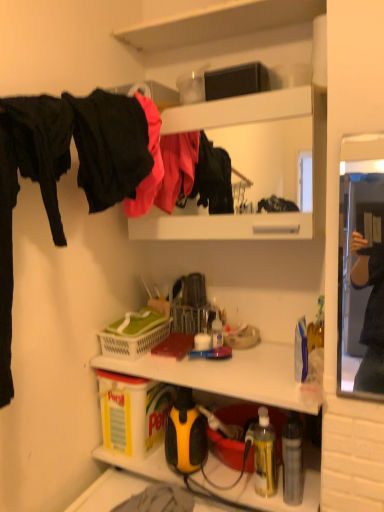
The height and width of the screenshot is (512, 384). Find the location of `metallic silver bottle at lower right, the first bottle in the right-to-left sequence`. metallic silver bottle at lower right, the first bottle in the right-to-left sequence is located at coordinates (292, 462).

Where is `black matte fabric at left, the 1th clothing positioned from the front`? Image resolution: width=384 pixels, height=512 pixels. black matte fabric at left, the 1th clothing positioned from the front is located at coordinates (111, 148).

At what (x,y) coordinates should I click in order to perform the action: click on black matte box at upper center, which appears as the second box when viewed from the left. Please return your answer as a coordinate pair (x, y). Image resolution: width=384 pixels, height=512 pixels. Looking at the image, I should click on (236, 81).

The width and height of the screenshot is (384, 512). What are the coordinates of `yellow plastic box at lower left, positioned as the 2th box in right-to-left order` in the screenshot? It's located at (132, 412).

In order to face translucent yellow bottle at lower right, marked as the first bottle in a left-to-right arrangement, should I rotate leftwards or rightwards?

It's best to rotate right around 9.762 degrees.

Where is `yellow/black plastic sprayer at lower center`? yellow/black plastic sprayer at lower center is located at coordinates (228, 374).

At what (x,y) coordinates should I click in order to perform the action: click on white matte cabinet at upper center. Please return your answer as a coordinate pair (x, y). Looking at the image, I should click on (251, 164).

Can you tell me how much white matte cabinet at upper center and translucent yellow bottle at lower right, marked as the first bottle in a left-to-right arrangement, differ in facing direction?

5.64 degrees separate the facing orientations of white matte cabinet at upper center and translucent yellow bottle at lower right, marked as the first bottle in a left-to-right arrangement.

Does white matte cabinet at upper center turn towards translucent yellow bottle at lower right, which is the 2th bottle in right-to-left order?

No, white matte cabinet at upper center is not oriented towards translucent yellow bottle at lower right, which is the 2th bottle in right-to-left order.

Which object is further away from the camera, white matte cabinet at upper center or translucent yellow bottle at lower right, which is the 2th bottle in right-to-left order?

Positioned behind is translucent yellow bottle at lower right, which is the 2th bottle in right-to-left order.

From the picture: How distant is white matte cabinet at upper center from translucent yellow bottle at lower right, marked as the first bottle in a left-to-right arrangement?

white matte cabinet at upper center is 1.63 meters from translucent yellow bottle at lower right, marked as the first bottle in a left-to-right arrangement.

Is matte black jacket at upper center, placed as the first clothing when sorted from back to front, facing towards white plastic picnic basket at center?

No, matte black jacket at upper center, placed as the first clothing when sorted from back to front, is not facing towards white plastic picnic basket at center.

Does matte black jacket at upper center, which ranks as the 2th clothing in front-to-back order, have a greater height compared to white plastic picnic basket at center?

Yes, matte black jacket at upper center, which ranks as the 2th clothing in front-to-back order, is taller than white plastic picnic basket at center.

Between matte black jacket at upper center, placed as the first clothing when sorted from back to front, and white plastic picnic basket at center, which one has larger size?

matte black jacket at upper center, placed as the first clothing when sorted from back to front.

From the image's perspective, does matte black jacket at upper center, which ranks as the 2th clothing in front-to-back order, appear lower than white plastic picnic basket at center?

Actually, matte black jacket at upper center, which ranks as the 2th clothing in front-to-back order, appears above white plastic picnic basket at center in the image.

Based on the photo, is metallic silver bottle at lower right, the second bottle viewed from the left, inside or outside of black matte box at upper center, which appears as the second box when viewed from the left?

metallic silver bottle at lower right, the second bottle viewed from the left, is located beyond the bounds of black matte box at upper center, which appears as the second box when viewed from the left.

Is metallic silver bottle at lower right, the second bottle viewed from the left, looking in the opposite direction of black matte box at upper center, the 1th box positioned from the right?

That's not correct — metallic silver bottle at lower right, the second bottle viewed from the left, is not looking away from black matte box at upper center, the 1th box positioned from the right.

Who is taller, metallic silver bottle at lower right, the second bottle viewed from the left, or black matte box at upper center, the 1th box positioned from the right?

Standing taller between the two is metallic silver bottle at lower right, the second bottle viewed from the left.

Looking at this image, is metallic silver bottle at lower right, the first bottle in the right-to-left sequence, far away from black matte box at upper center, the first box when ordered from top to bottom?

metallic silver bottle at lower right, the first bottle in the right-to-left sequence, is near black matte box at upper center, the first box when ordered from top to bottom, not far away.

Between black matte fabric at left, the 1th clothing positioned from the front, and yellow plastic box at lower left, positioned as the 2th box in right-to-left order, which one has more height?

black matte fabric at left, the 1th clothing positioned from the front.

Could you tell me if black matte fabric at left, the second clothing in the back-to-front sequence, is facing yellow plastic box at lower left, the second box in the top-to-bottom sequence?

No, black matte fabric at left, the second clothing in the back-to-front sequence, is not turned towards yellow plastic box at lower left, the second box in the top-to-bottom sequence.

Would you say black matte fabric at left, the second clothing in the back-to-front sequence, is outside yellow plastic box at lower left, positioned as the 2th box in right-to-left order?

Yes, black matte fabric at left, the second clothing in the back-to-front sequence, is not within yellow plastic box at lower left, positioned as the 2th box in right-to-left order.

From a real-world perspective, is black matte fabric at left, the 1th clothing positioned from the front, physically located above or below yellow plastic box at lower left, the second box in the top-to-bottom sequence?

black matte fabric at left, the 1th clothing positioned from the front, is above yellow plastic box at lower left, the second box in the top-to-bottom sequence.

Could you tell me if matte black jacket at upper center, which ranks as the 2th clothing in front-to-back order, is turned towards yellow plastic box at lower left, the second box in the top-to-bottom sequence?

No, matte black jacket at upper center, which ranks as the 2th clothing in front-to-back order, is not aimed at yellow plastic box at lower left, the second box in the top-to-bottom sequence.

Is point (135, 93) less distant than point (133, 394)?

Yes, it is.

In terms of width, does translucent yellow bottle at lower right, marked as the first bottle in a left-to-right arrangement, look wider or thinner when compared to yellow plastic box at lower left, placed as the first box when sorted from bottom to top?

translucent yellow bottle at lower right, marked as the first bottle in a left-to-right arrangement, is thinner than yellow plastic box at lower left, placed as the first box when sorted from bottom to top.

Is translucent yellow bottle at lower right, marked as the first bottle in a left-to-right arrangement, facing towards yellow plastic box at lower left, placed as the first box when sorted from left to right?

No, translucent yellow bottle at lower right, marked as the first bottle in a left-to-right arrangement, does not turn towards yellow plastic box at lower left, placed as the first box when sorted from left to right.

Is translucent yellow bottle at lower right, marked as the first bottle in a left-to-right arrangement, to the right of yellow plastic box at lower left, placed as the first box when sorted from left to right, from the viewer's perspective?

Yes, translucent yellow bottle at lower right, marked as the first bottle in a left-to-right arrangement, is to the right of yellow plastic box at lower left, placed as the first box when sorted from left to right.

Considering the sizes of objects translucent yellow bottle at lower right, marked as the first bottle in a left-to-right arrangement, and yellow plastic box at lower left, positioned as the 2th box in right-to-left order, in the image provided, who is smaller, translucent yellow bottle at lower right, marked as the first bottle in a left-to-right arrangement, or yellow plastic box at lower left, positioned as the 2th box in right-to-left order,?

With smaller size is translucent yellow bottle at lower right, marked as the first bottle in a left-to-right arrangement.

Does yellow/black plastic sprayer at lower center have a lesser width compared to matte black jacket at upper center, which ranks as the 2th clothing in front-to-back order?

Incorrect, the width of yellow/black plastic sprayer at lower center is not less than that of matte black jacket at upper center, which ranks as the 2th clothing in front-to-back order.

Is yellow/black plastic sprayer at lower center not near matte black jacket at upper center, which ranks as the 2th clothing in front-to-back order?

They are positioned close to each other.

In the image, is yellow/black plastic sprayer at lower center positioned in front of or behind matte black jacket at upper center, which ranks as the 2th clothing in front-to-back order?

yellow/black plastic sprayer at lower center is positioned closer to the viewer than matte black jacket at upper center, which ranks as the 2th clothing in front-to-back order.

Which is correct: yellow/black plastic sprayer at lower center is inside matte black jacket at upper center, placed as the first clothing when sorted from back to front, or outside of it?

yellow/black plastic sprayer at lower center is not enclosed by matte black jacket at upper center, placed as the first clothing when sorted from back to front.

Find the location of a particular element. The image size is (384, 512). cabinet that appears on the left of translucent yellow bottle at lower right, which is the 2th bottle in right-to-left order is located at coordinates (251, 164).

There is a white plastic picnic basket at center. Identify the location of the 2nd clothing above it (from the image's perspective). (153, 164).

Looking at the image, which one is located closer to black matte box at upper center, which ranks as the 2th box in bottom-to-top order, black matte fabric at left, the 1th clothing positioned from the front, or white matte cabinet at upper center?

black matte fabric at left, the 1th clothing positioned from the front, lies closer to black matte box at upper center, which ranks as the 2th box in bottom-to-top order, than the other object.

Which object lies nearer to the anchor point yellow/black plastic sprayer at lower center, yellow plastic box at lower left, positioned as the 2th box in right-to-left order, or white matte cabinet at upper center?

Based on the image, yellow plastic box at lower left, positioned as the 2th box in right-to-left order, appears to be nearer to yellow/black plastic sprayer at lower center.

Looking at the image, which one is located further to translucent yellow bottle at lower right, marked as the first bottle in a left-to-right arrangement, black matte box at upper center, the first box when ordered from top to bottom, or metallic silver bottle at lower right, the first bottle in the right-to-left sequence?

black matte box at upper center, the first box when ordered from top to bottom, is positioned further to the anchor translucent yellow bottle at lower right, marked as the first bottle in a left-to-right arrangement.

Estimate the real-world distances between objects in this image. Which object is closer to white plastic picnic basket at center, metallic silver bottle at lower right, the first bottle in the right-to-left sequence, or yellow/black plastic sprayer at lower center?

yellow/black plastic sprayer at lower center.

Considering their positions, is matte black jacket at upper center, placed as the first clothing when sorted from back to front, positioned closer to white plastic picnic basket at center than metallic silver bottle at lower right, the second bottle viewed from the left?

matte black jacket at upper center, placed as the first clothing when sorted from back to front, lies closer to white plastic picnic basket at center than the other object.

Based on their spatial positions, is translucent yellow bottle at lower right, marked as the first bottle in a left-to-right arrangement, or black matte box at upper center, the 1th box positioned from the right, further from metallic silver bottle at lower right, the second bottle viewed from the left?

black matte box at upper center, the 1th box positioned from the right, is further to metallic silver bottle at lower right, the second bottle viewed from the left.

From the image, which object appears to be nearer to yellow plastic box at lower left, the second box in the top-to-bottom sequence, white plastic picnic basket at center or black matte fabric at left, the second clothing in the back-to-front sequence?

The object closer to yellow plastic box at lower left, the second box in the top-to-bottom sequence, is white plastic picnic basket at center.

Which object lies nearer to the anchor point yellow plastic box at lower left, placed as the first box when sorted from left to right, matte black jacket at upper center, which ranks as the 2th clothing in front-to-back order, or metallic silver bottle at lower right, the second bottle viewed from the left?

metallic silver bottle at lower right, the second bottle viewed from the left, is positioned closer to the anchor yellow plastic box at lower left, placed as the first box when sorted from left to right.

Where is `box between matte black jacket at upper center, which ranks as the 2th clothing in front-to-back order, and translucent yellow bottle at lower right, marked as the first bottle in a left-to-right arrangement, vertically`? The image size is (384, 512). box between matte black jacket at upper center, which ranks as the 2th clothing in front-to-back order, and translucent yellow bottle at lower right, marked as the first bottle in a left-to-right arrangement, vertically is located at coordinates (132, 412).

Locate an element on the screen. The width and height of the screenshot is (384, 512). picnic basket between black matte fabric at left, the second clothing in the back-to-front sequence, and translucent yellow bottle at lower right, marked as the first bottle in a left-to-right arrangement, vertically is located at coordinates coord(134,334).

Find the location of `cabinet between black matte box at upper center, the first box when ordered from top to bottom, and yellow plastic box at lower left, the second box in the top-to-bottom sequence, in the up-down direction`. cabinet between black matte box at upper center, the first box when ordered from top to bottom, and yellow plastic box at lower left, the second box in the top-to-bottom sequence, in the up-down direction is located at coordinates (251, 164).

You are a GUI agent. You are given a task and a screenshot of the screen. Output one action in this format:
    pyautogui.click(x=<x>, y=<y>)
    Task: Click on the cabinet between black matte box at upper center, which ranks as the 2th box in bottom-to-top order, and white plastic picnic basket at center vertically
    The width and height of the screenshot is (384, 512).
    Given the screenshot: What is the action you would take?
    pyautogui.click(x=251, y=164)